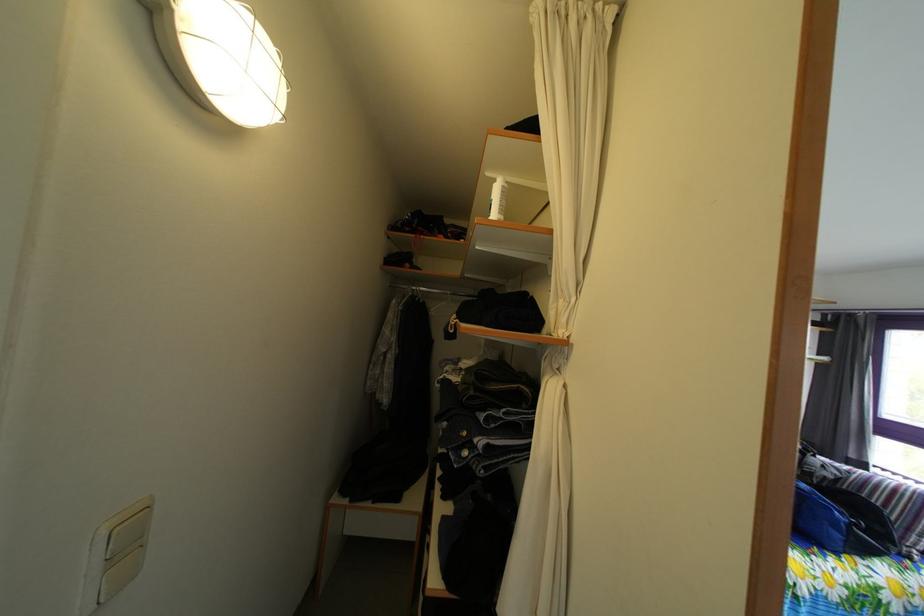
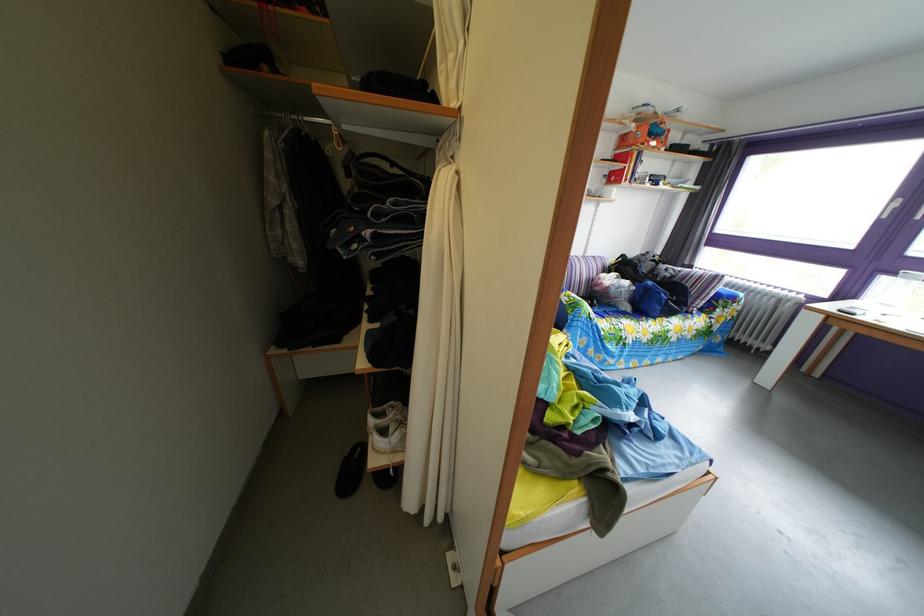
Question: How did the camera likely rotate?

Choices:
 (A) Left
 (B) Right
 (C) Up
 (D) Down

Answer: (D)